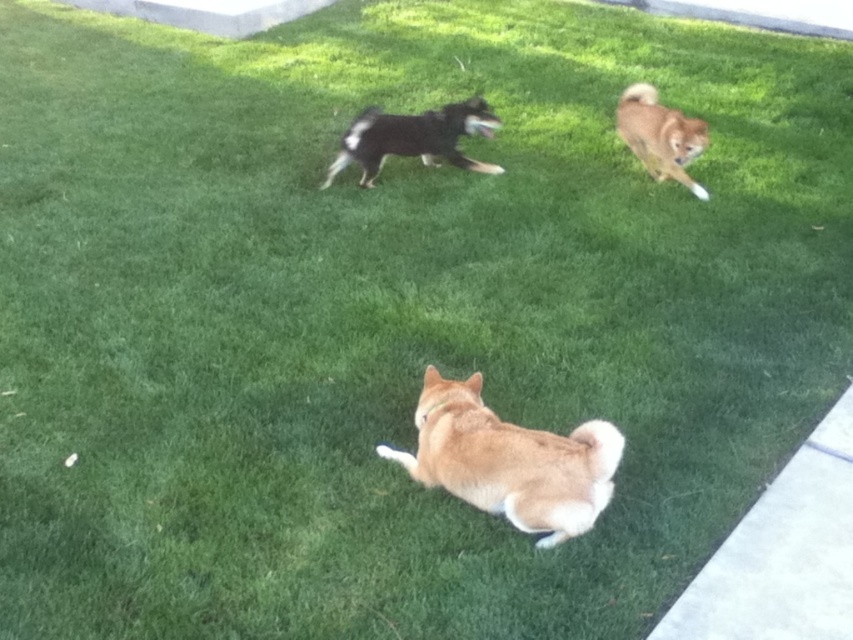
Where is the light brown fur at center located in the image?

The light brown fur at center is located at point (509,461) in the image.

Based on the photo, you are observing the dogs in the image. Which dog is closer to the ground, the light brown fur at center or the black glossy dog at center?

The light brown fur at center is positioned under the black glossy dog at center, so it is closer to the ground.